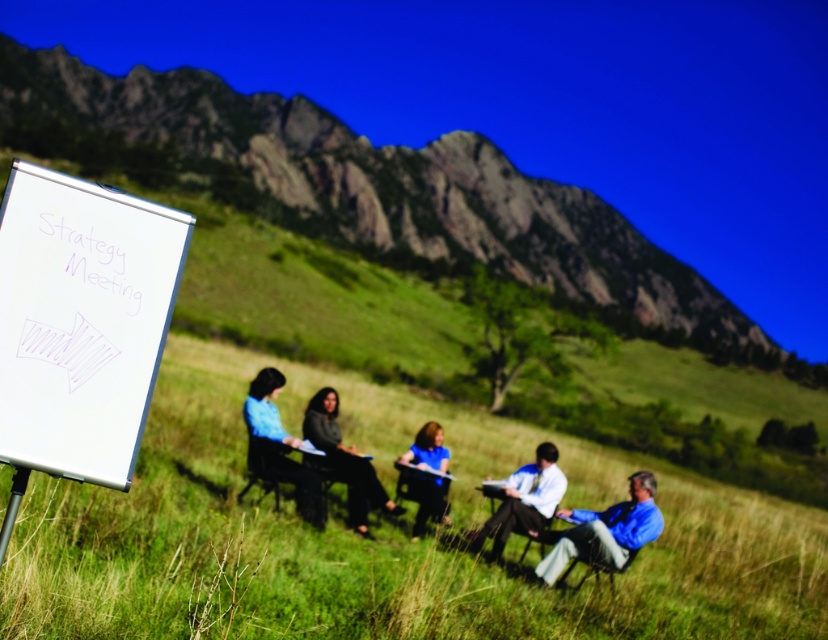
Who is higher up, blue fabric shirt at center or metallic silver chair at lower right?

Positioned higher is blue fabric shirt at center.

Describe the element at coordinates (427, 500) in the screenshot. I see `blue fabric shirt at center` at that location.

What are the coordinates of `blue fabric shirt at center` in the screenshot? It's located at (427, 500).

In the scene shown: Between rugged granite mountain at upper center and light blue shirt at center, which one is positioned higher?

rugged granite mountain at upper center is higher up.

Who is shorter, rugged granite mountain at upper center or light blue shirt at center?

Standing shorter between the two is light blue shirt at center.

Which is in front, point (379, 200) or point (557, 454)?

Point (557, 454) is in front.

The image size is (828, 640). Find the location of `rugged granite mountain at upper center`. rugged granite mountain at upper center is located at coordinates (384, 189).

Does blue fabric chair at lower right have a smaller size compared to matte black chair at center?

No.

The height and width of the screenshot is (640, 828). I want to click on blue fabric chair at lower right, so click(605, 531).

This screenshot has width=828, height=640. What are the coordinates of `blue fabric chair at lower right` in the screenshot? It's located at (605, 531).